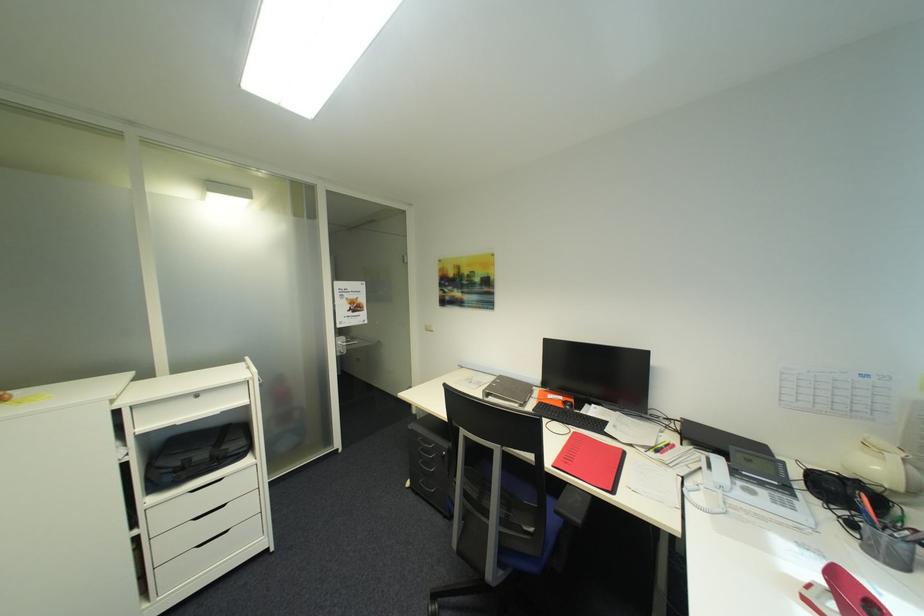
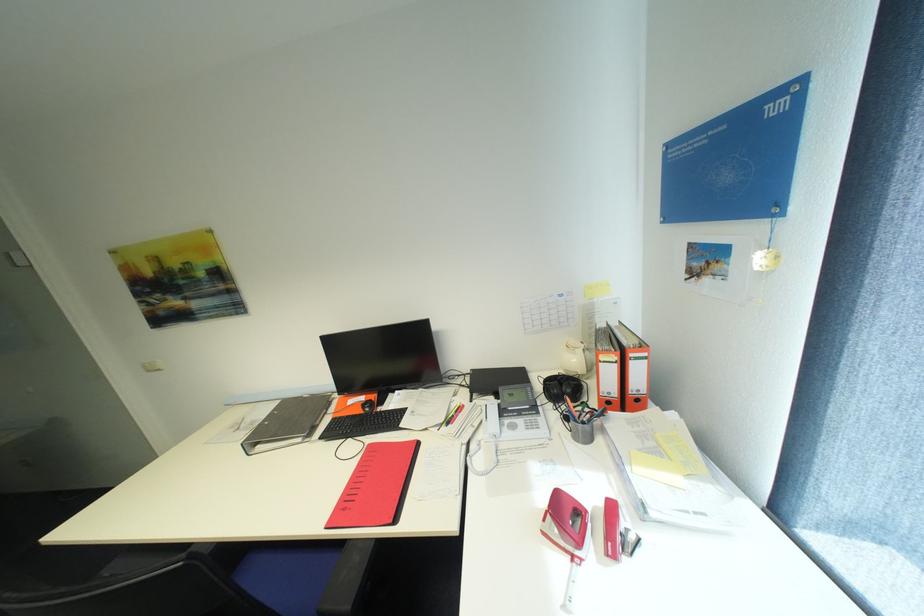
Question: The camera is either moving clockwise (left) or counter-clockwise (right) around the object. The first image is from the beginning of the video and the second image is from the end. Is the camera moving left or right when shooting the video?

Choices:
 (A) Left
 (B) Right

Answer: (A)